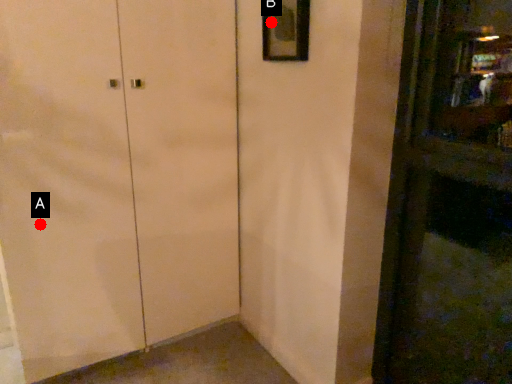
Question: Two points are circled on the image, labeled by A and B beside each circle. Which point is farther from the camera taking this photo?

Choices:
 (A) A is further
 (B) B is further

Answer: (A)